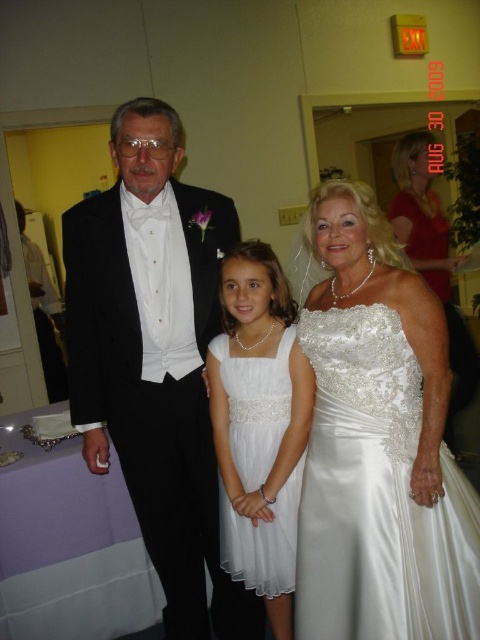
You are a photographer at a wedding and need to adjust the camera focus. The black satin tuxedo at left and the white satin dress at center are in the frame. Which one should you focus on first if you want to ensure the taller object is sharp?

The black satin tuxedo at left is taller than the white satin dress at center, so you should focus on the black satin tuxedo at left first to ensure it is sharp.